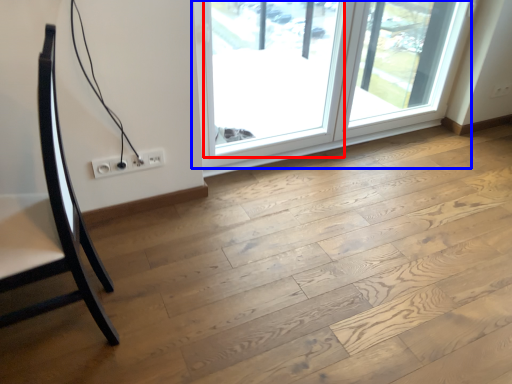
Question: Which of the following is the farthest to the observer, window (highlighted by a red box) or window (highlighted by a blue box)?

Choices:
 (A) window
 (B) window

Answer: (B)